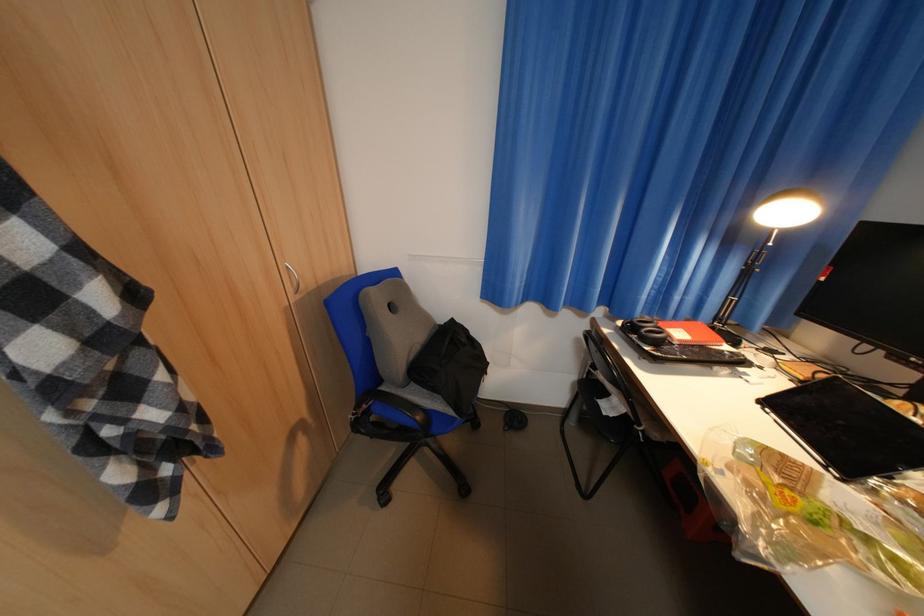
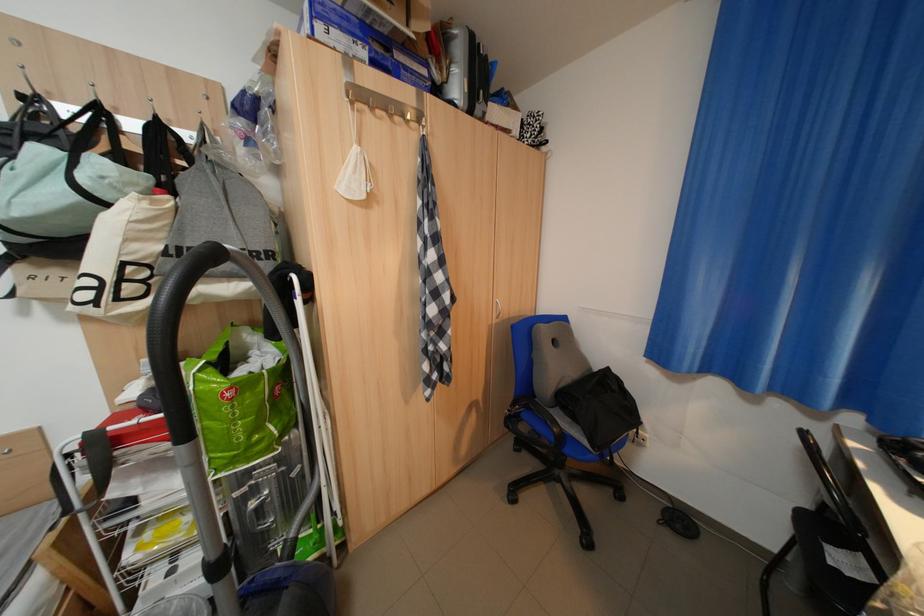
Question: Based on the continuous images, in which direction is the camera rotating? Reply with the corresponding letter.

Choices:
 (A) Left
 (B) Right
 (C) Up
 (D) Down

Answer: (A)